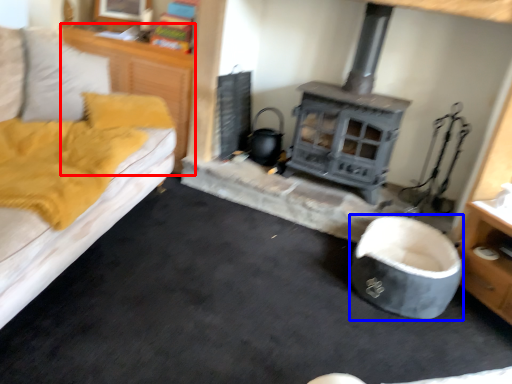
Question: Which object appears farthest to the camera in this image, dresser (highlighted by a red box) or bean bag chair (highlighted by a blue box)?

Choices:
 (A) dresser
 (B) bean bag chair

Answer: (A)